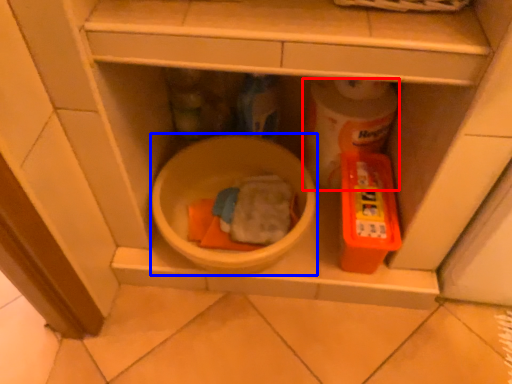
Question: Which point is further to the camera, toilet paper (highlighted by a red box) or mixing bowl (highlighted by a blue box)?

Choices:
 (A) toilet paper
 (B) mixing bowl

Answer: (A)